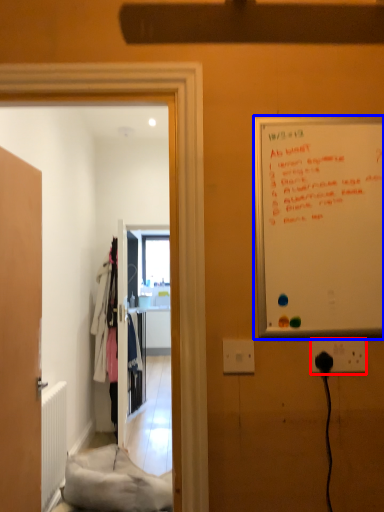
Question: Which object is further to the camera taking this photo, electric outlet (highlighted by a red box) or whiteboard (highlighted by a blue box)?

Choices:
 (A) electric outlet
 (B) whiteboard

Answer: (A)